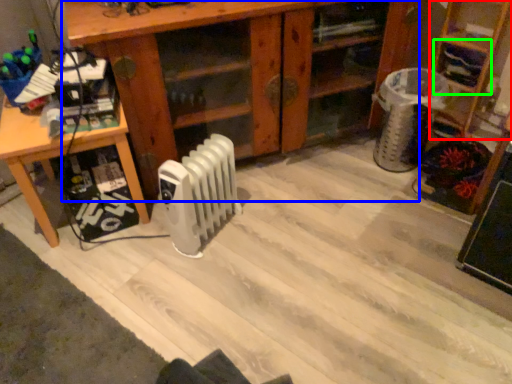
Question: Which object is the closest to the shelf (highlighted by a red box)? Choose among these: shelf (highlighted by a blue box) or shelf (highlighted by a green box).

Choices:
 (A) shelf
 (B) shelf

Answer: (B)